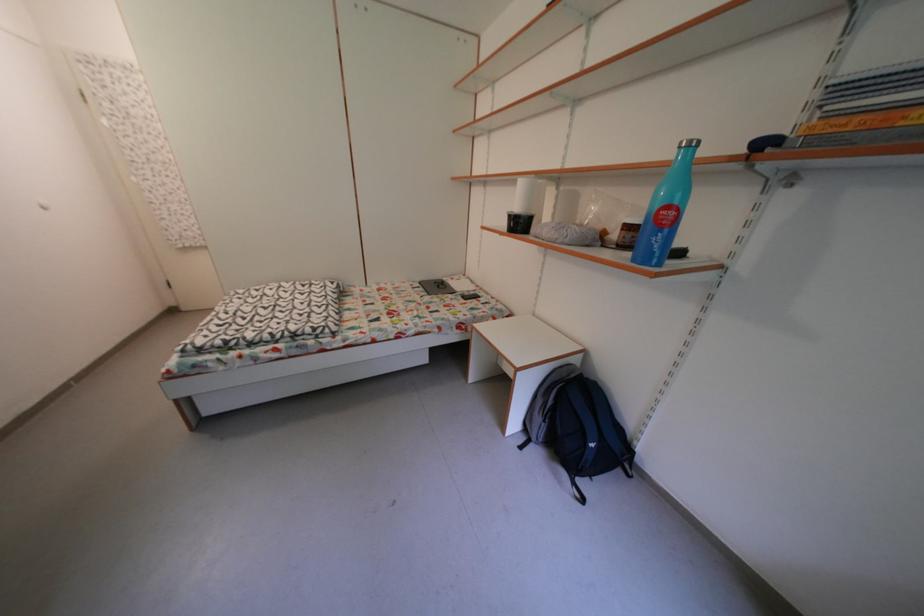
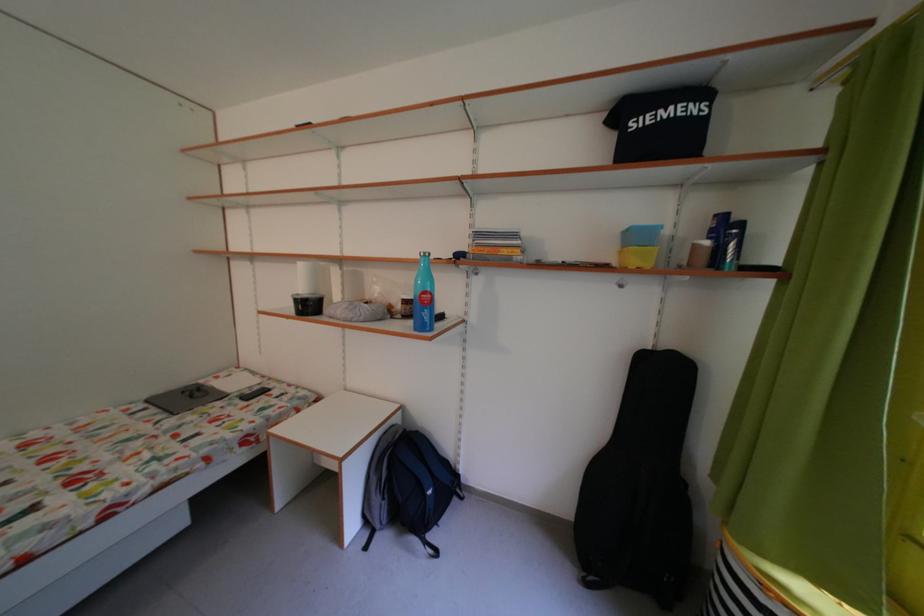
The point at (631, 252) is marked in the first image. Where is the corresponding point in the second image?

(416, 322)